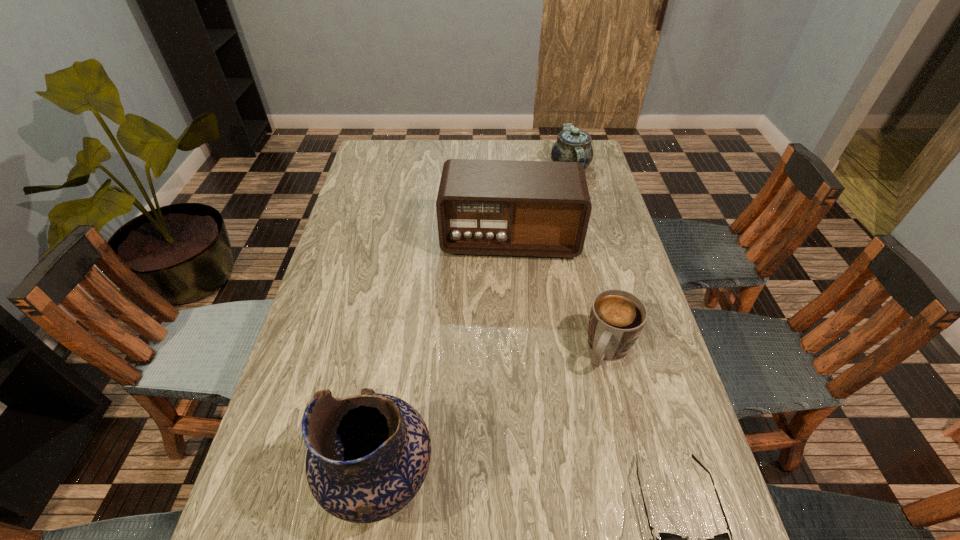
Locate an element on the screen. Image resolution: width=960 pixels, height=540 pixels. free space at the left edge is located at coordinates (321, 299).

Find the location of a particular element. This screenshot has height=540, width=960. free space at the right edge of the desktop is located at coordinates (642, 401).

Find the location of a particular element. free spot between the radio receiver and the mug is located at coordinates (559, 295).

I want to click on free spot between the third nearest object and the farthest object, so click(x=589, y=259).

Locate an element on the screen. This screenshot has height=540, width=960. vacant area between the radio receiver and the mug is located at coordinates (559, 295).

Locate an element on the screen. The image size is (960, 540). free space between the third nearest object and the chinaware is located at coordinates (589, 259).

This screenshot has width=960, height=540. In order to click on empty space between the third nearest object and the farthest object in this screenshot , I will do `click(589, 259)`.

Identify which object is the fourth nearest to the tallest object. Please provide its 2D coordinates. Your answer should be formatted as a tuple, i.e. [(x, y)], where the tuple contains the x and y coordinates of a point satisfying the conditions above.

[(572, 145)]

You are a GUI agent. You are given a task and a screenshot of the screen. Output one action in this format:
    pyautogui.click(x=<x>, y=<y>)
    Task: Click on the object that stands as the closest to the tallest object
    
    Given the screenshot: What is the action you would take?
    pyautogui.click(x=617, y=317)

Find the location of `vacant region that satisfies the following two spatial constraints: 1. on the back side of the farthest object; 2. on the left side of the fourth shortest object`. vacant region that satisfies the following two spatial constraints: 1. on the back side of the farthest object; 2. on the left side of the fourth shortest object is located at coordinates (505, 167).